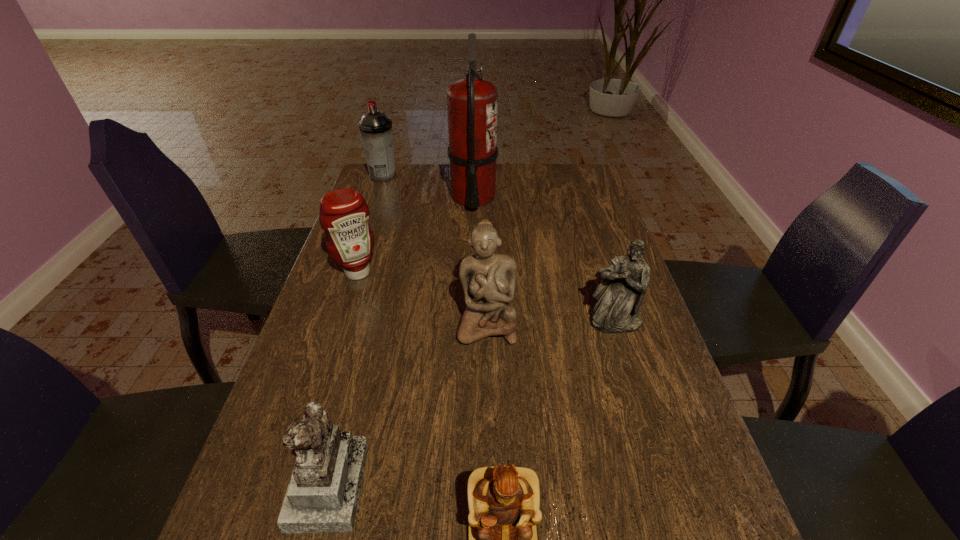
The image size is (960, 540). Find the location of `fire extinguisher`. fire extinguisher is located at coordinates (472, 103).

Image resolution: width=960 pixels, height=540 pixels. In order to click on aerosol can in this screenshot , I will do `click(375, 127)`.

This screenshot has height=540, width=960. In order to click on the fifth nearest object in this screenshot , I will do `click(344, 215)`.

Identify the location of the rightmost object. (620, 293).

The image size is (960, 540). I want to click on the leftmost figurine, so click(323, 495).

You are a GUI agent. You are given a task and a screenshot of the screen. Output one action in this format:
    pyautogui.click(x=<x>, y=<y>)
    Task: Click on the free space located 0.350m toward the nozzle of the fire extinguisher
    
    Given the screenshot: What is the action you would take?
    coord(596,197)

Identify the location of blank space located on the front of the aerosol can. This screenshot has width=960, height=540. (372, 210).

This screenshot has width=960, height=540. I want to click on free space located on the right of the fifth nearest object, so click(442, 272).

Identify the location of vacant area situated 0.370m on the front-facing side of the rightmost object. (668, 490).

Where is `free space located on the front-facing side of the leftmost figurine`? free space located on the front-facing side of the leftmost figurine is located at coordinates (550, 483).